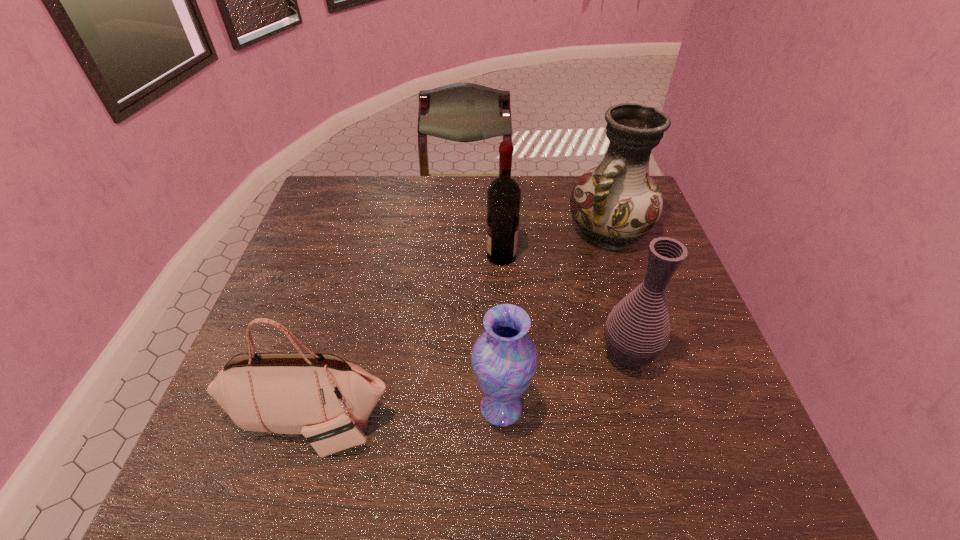
In the image, there is a desktop. Where is `vacant space at the right edge`? This screenshot has height=540, width=960. vacant space at the right edge is located at coordinates (711, 410).

This screenshot has width=960, height=540. What are the coordinates of `free location at the far left corner of the desktop` in the screenshot? It's located at (351, 178).

Identify the location of vacant area between the leftmost vase and the third farthest object. (564, 381).

Locate an element on the screen. vacant space that's between the third farthest object and the leftmost vase is located at coordinates (564, 381).

Identify the location of free space between the leftmost object and the second nearest vase. (468, 389).

Where is `vacant area that lies between the farthest vase and the leftmost vase`? This screenshot has width=960, height=540. vacant area that lies between the farthest vase and the leftmost vase is located at coordinates (555, 319).

Find the location of `free space between the second farthest vase and the farthest vase`. free space between the second farthest vase and the farthest vase is located at coordinates (618, 293).

This screenshot has width=960, height=540. I want to click on vacant area between the leftmost vase and the handbag, so click(x=405, y=415).

Where is `free space that is in between the handbag and the second nearest vase`? The height and width of the screenshot is (540, 960). free space that is in between the handbag and the second nearest vase is located at coordinates (468, 389).

Find the location of a particular element. vacant area between the handbag and the nearest vase is located at coordinates (405, 415).